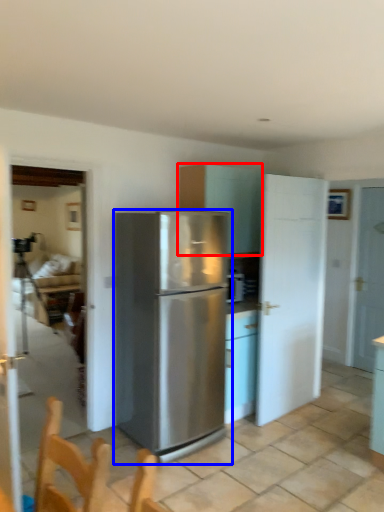
Question: Which object is further to the camera taking this photo, cabinetry (highlighted by a red box) or refrigerator (highlighted by a blue box)?

Choices:
 (A) cabinetry
 (B) refrigerator

Answer: (A)